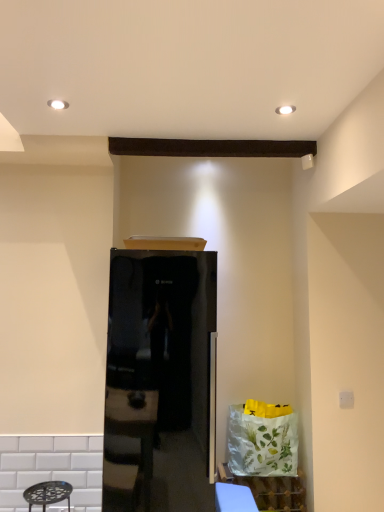
Question: Does white glossy cabinet at lower right have a lesser height compared to blue fabric table at lower center?

Choices:
 (A) yes
 (B) no

Answer: (B)

Question: From the image's perspective, is white glossy cabinet at lower right on blue fabric table at lower center?

Choices:
 (A) yes
 (B) no

Answer: (B)

Question: Is white glossy cabinet at lower right to the right of blue fabric table at lower center from the viewer's perspective?

Choices:
 (A) no
 (B) yes

Answer: (B)

Question: From a real-world perspective, is white glossy cabinet at lower right over blue fabric table at lower center?

Choices:
 (A) no
 (B) yes

Answer: (A)

Question: Could you tell me if white glossy cabinet at lower right is facing blue fabric table at lower center?

Choices:
 (A) no
 (B) yes

Answer: (B)

Question: Would you say white glossy cabinet at lower right is a long distance from blue fabric table at lower center?

Choices:
 (A) yes
 (B) no

Answer: (B)

Question: Does white glossy cabinet at lower right have a smaller size compared to glossy black refrigerator at center?

Choices:
 (A) no
 (B) yes

Answer: (B)

Question: From the image's perspective, is white glossy cabinet at lower right beneath glossy black refrigerator at center?

Choices:
 (A) no
 (B) yes

Answer: (B)

Question: Is white glossy cabinet at lower right further to camera compared to glossy black refrigerator at center?

Choices:
 (A) no
 (B) yes

Answer: (B)

Question: From a real-world perspective, is white glossy cabinet at lower right over glossy black refrigerator at center?

Choices:
 (A) yes
 (B) no

Answer: (B)

Question: Is white glossy cabinet at lower right at the left side of glossy black refrigerator at center?

Choices:
 (A) yes
 (B) no

Answer: (B)

Question: Is glossy black refrigerator at center completely or partially inside white glossy cabinet at lower right?

Choices:
 (A) no
 (B) yes

Answer: (A)

Question: Is blue fabric table at lower center positioned far away from white glossy cabinet at lower right?

Choices:
 (A) yes
 (B) no

Answer: (B)